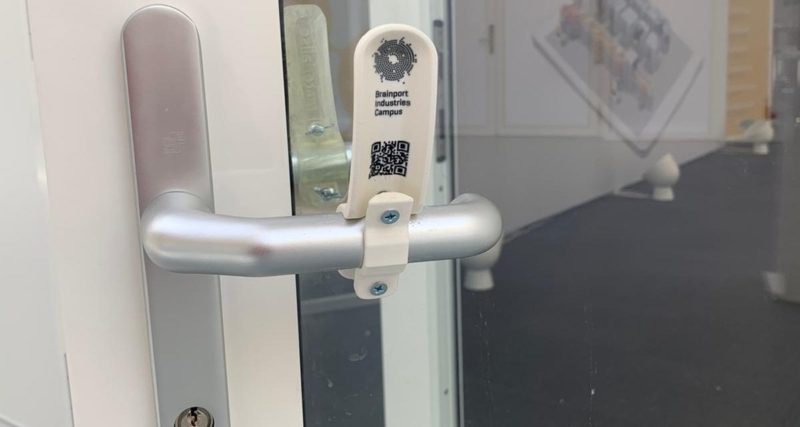
Locate an element on the screen. The width and height of the screenshot is (800, 427). wall is located at coordinates (552, 169).